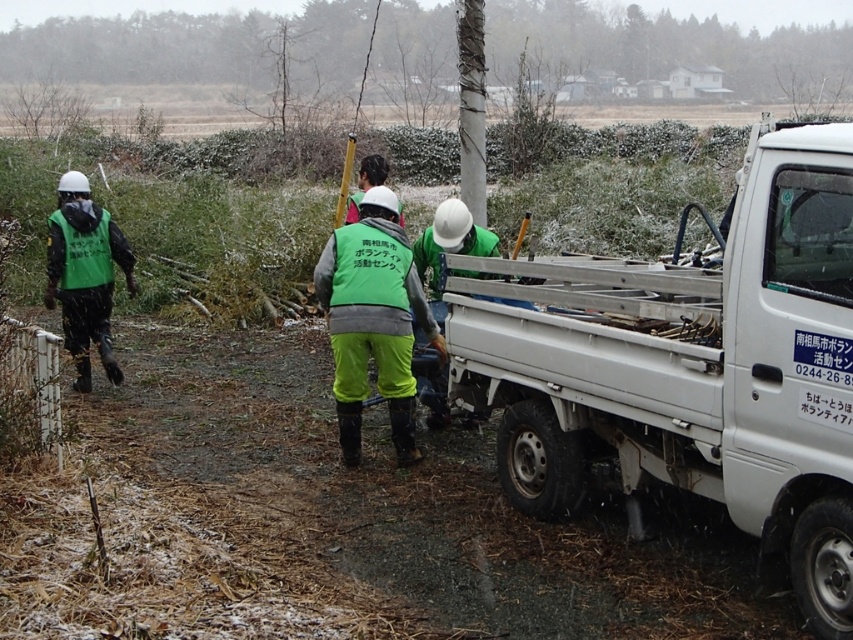
From the picture: Is the position of white bark tree at upper center more distant than that of green matte safety vest at left?

Yes, it is.

Between point (19, 38) and point (61, 212), which one is positioned behind?

Point (19, 38)

Locate an element on the screen. white bark tree at upper center is located at coordinates (660, 44).

Image resolution: width=853 pixels, height=640 pixels. What do you see at coordinates (660, 44) in the screenshot?
I see `white bark tree at upper center` at bounding box center [660, 44].

Between white bark tree at upper center and green fabric safety vest at center, which one is positioned higher?

white bark tree at upper center is higher up.

Is point (579, 65) closer to camera compared to point (381, 308)?

No, it is not.

The image size is (853, 640). I want to click on white bark tree at upper center, so click(660, 44).

Is green matte vest at left to the left of green matte safety vest at left from the viewer's perspective?

Correct, you'll find green matte vest at left to the left of green matte safety vest at left.

The height and width of the screenshot is (640, 853). Describe the element at coordinates (85, 275) in the screenshot. I see `green matte vest at left` at that location.

Where is `green matte vest at left`? This screenshot has width=853, height=640. green matte vest at left is located at coordinates (85, 275).